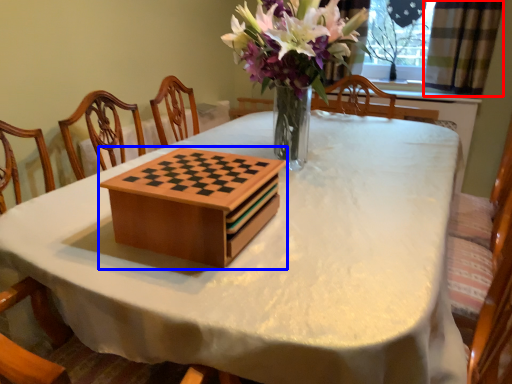
Question: Among these objects, which one is nearest to the camera, curtain (highlighted by a red box) or cardboard box (highlighted by a blue box)?

Choices:
 (A) curtain
 (B) cardboard box

Answer: (B)